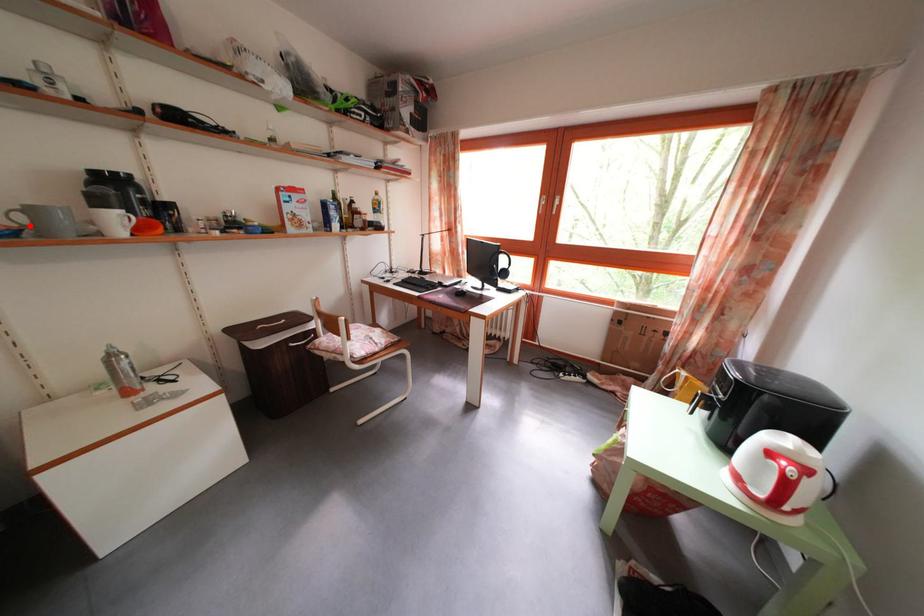
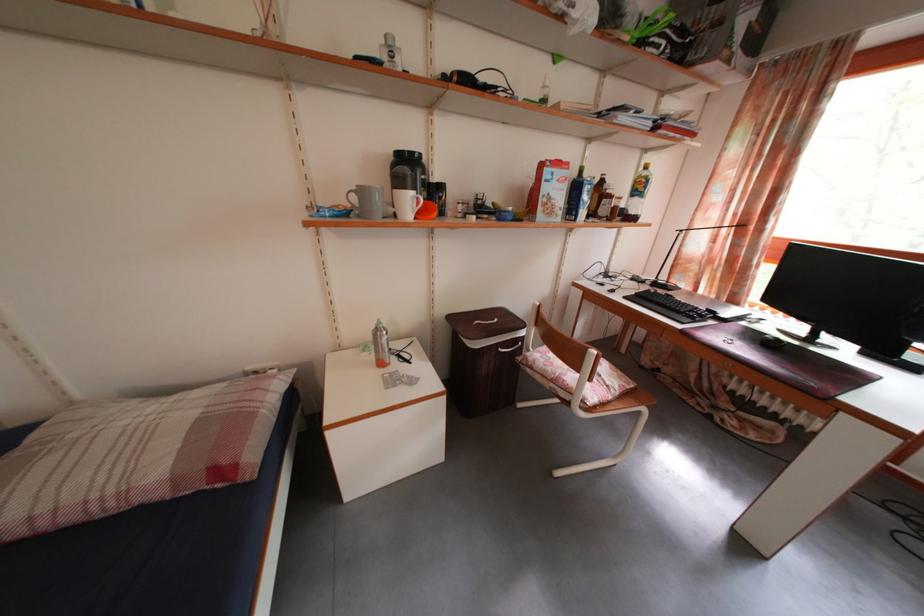
Find the pixel in the second image that matches the highlighted location in the first image.

(361, 206)